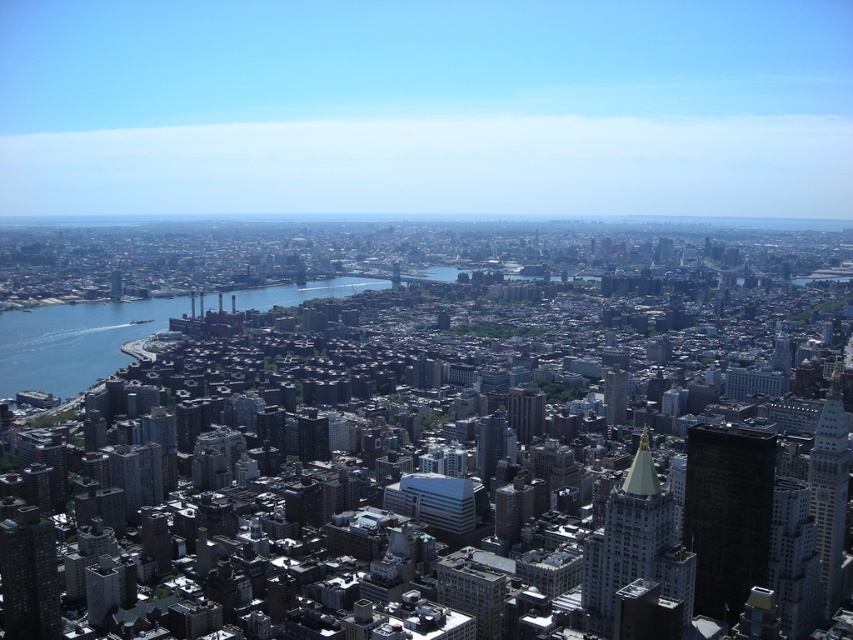
Can you confirm if blue liquid water at lower left is positioned to the left of matte glass skyscraper at center?

Yes, blue liquid water at lower left is to the left of matte glass skyscraper at center.

Is point (91, 307) closer to camera compared to point (614, 420)?

No, (91, 307) is further to viewer.

Which is behind, point (236, 301) or point (625, 400)?

Point (625, 400)

Where is `blue liquid water at lower left`? The width and height of the screenshot is (853, 640). blue liquid water at lower left is located at coordinates (74, 340).

Does blue liquid water at lower left have a greater height compared to black glass building at right?

Incorrect, blue liquid water at lower left's height is not larger of black glass building at right's.

Between point (120, 364) and point (752, 545), which one is positioned in front?

Point (120, 364) is in front.

Which is in front, point (61, 326) or point (751, 561)?

Point (61, 326) is more forward.

Find the location of a particular element. blue liquid water at lower left is located at coordinates (74, 340).

Can you confirm if black glass building at right is smaller than dark gray concrete skyscraper at lower left?

Incorrect, black glass building at right is not smaller in size than dark gray concrete skyscraper at lower left.

What do you see at coordinates (727, 515) in the screenshot? The height and width of the screenshot is (640, 853). I see `black glass building at right` at bounding box center [727, 515].

Where is `black glass building at right`? This screenshot has height=640, width=853. black glass building at right is located at coordinates (727, 515).